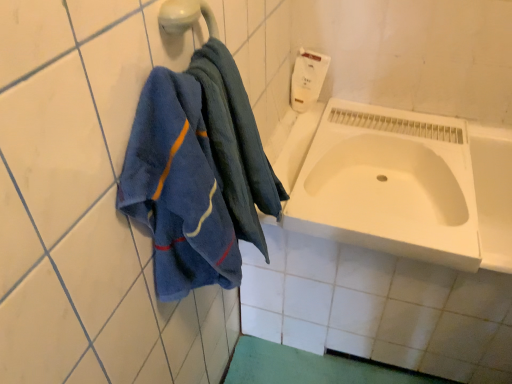
Where is `white glossy bathtub at center`? white glossy bathtub at center is located at coordinates (393, 266).

Identify the location of white matte sink at lower right. (389, 185).

What are the coordinates of `blue cotton towel at left` in the screenshot? It's located at (236, 143).

Considering the points (340, 236) and (304, 74), which point is in front, point (340, 236) or point (304, 74)?

Point (340, 236)

How distant is white matte sink at lower right from white matte soap dispenser at upper right?

The distance of white matte sink at lower right from white matte soap dispenser at upper right is 16.37 inches.

Is white matte sink at lower right not inside white matte soap dispenser at upper right?

Indeed, white matte sink at lower right is completely outside white matte soap dispenser at upper right.

Considering the sizes of objects white matte sink at lower right and white matte soap dispenser at upper right in the image provided, who is smaller, white matte sink at lower right or white matte soap dispenser at upper right?

Smaller between the two is white matte soap dispenser at upper right.

From the image's perspective, relative to blue cotton towel at left, is white glossy bathtub at center above or below?

Based on their image positions, white glossy bathtub at center is located beneath blue cotton towel at left.

Consider the image. From their relative heights in the image, would you say white glossy bathtub at center is taller or shorter than blue cotton towel at left?

Clearly, white glossy bathtub at center is taller compared to blue cotton towel at left.

Which object is positioned more to the left, white glossy bathtub at center or blue cotton towel at left?

blue cotton towel at left.

How many degrees apart are the facing directions of white glossy bathtub at center and blue cotton towel at left?

83.1 degrees separate the facing orientations of white glossy bathtub at center and blue cotton towel at left.

Is blue cotton towel at left to the right of white glossy bathtub at center from the viewer's perspective?

No.

Is blue cotton towel at left not near white glossy bathtub at center?

No, blue cotton towel at left is in close proximity to white glossy bathtub at center.

Is blue cotton towel at left positioned beyond the bounds of white glossy bathtub at center?

That's correct, blue cotton towel at left is outside of white glossy bathtub at center.

From a real-world perspective, is blue cotton towel at left on white glossy bathtub at center?

Yes, from a real-world perspective, blue cotton towel at left is above white glossy bathtub at center.

How many degrees apart are the facing directions of white matte soap dispenser at upper right and white glossy bathtub at center?

0.946 degrees separate the facing orientations of white matte soap dispenser at upper right and white glossy bathtub at center.

Which object is positioned more to the right, white matte soap dispenser at upper right or white glossy bathtub at center?

white glossy bathtub at center is more to the right.

Between point (304, 95) and point (356, 218), which one is positioned behind?

Positioned behind is point (304, 95).

Can you tell me how much white matte sink at lower right and blue cotton towel at left differ in facing direction?

white matte sink at lower right and blue cotton towel at left are facing 84.3 degrees away from each other.

From a real-world perspective, between white matte sink at lower right and blue cotton towel at left, who is vertically higher?

blue cotton towel at left, from a real-world perspective.

From the image's perspective, is white matte sink at lower right located above or below blue cotton towel at left?

From the image's perspective, white matte sink at lower right appears above blue cotton towel at left.

Considering the positions of objects white matte sink at lower right and blue cotton towel at left in the image provided, who is in front, white matte sink at lower right or blue cotton towel at left?

blue cotton towel at left is more forward.

How many degrees apart are the facing directions of blue cotton towel at left and white matte sink at lower right?

84.3 degrees separate the facing orientations of blue cotton towel at left and white matte sink at lower right.

Which is further, [226,170] or [311,177]?

The point [311,177] is farther.

Choose the correct answer: Is blue cotton towel at left inside white matte sink at lower right or outside it?

blue cotton towel at left exists outside the volume of white matte sink at lower right.

Considering the positions of objects blue cotton towel at left and white matte sink at lower right in the image provided, who is in front, blue cotton towel at left or white matte sink at lower right?

blue cotton towel at left is in front.

Based on the photo, from the image's perspective, is white glossy bathtub at center over white matte sink at lower right?

No, from the image's perspective, white glossy bathtub at center is not on top of white matte sink at lower right.

Where is `sink located behind the white glossy bathtub at center`? This screenshot has width=512, height=384. sink located behind the white glossy bathtub at center is located at coordinates (389, 185).

Looking at this image, considering the relative positions of white glossy bathtub at center and white matte sink at lower right in the image provided, is white glossy bathtub at center to the right of white matte sink at lower right from the viewer's perspective?

Yes, white glossy bathtub at center is to the right of white matte sink at lower right.

Is white glossy bathtub at center far from white matte sink at lower right?

white glossy bathtub at center is near white matte sink at lower right, not far away.

Locate an element on the screen. The image size is (512, 384). sink below the white matte soap dispenser at upper right (from a real-world perspective) is located at coordinates (389, 185).

You are a GUI agent. You are given a task and a screenshot of the screen. Output one action in this format:
    pyautogui.click(x=<x>, y=<y>)
    Task: Click on the bath below the blue cotton towel at left (from the image's perspective)
    The width and height of the screenshot is (512, 384).
    Given the screenshot: What is the action you would take?
    pyautogui.click(x=393, y=266)

From the image, which object appears to be nearer to white matte sink at lower right, white matte soap dispenser at upper right or blue cotton towel at left?

Based on the image, white matte soap dispenser at upper right appears to be nearer to white matte sink at lower right.

Which object lies nearer to the anchor point white matte soap dispenser at upper right, white glossy bathtub at center or blue cotton towel at left?

The object closer to white matte soap dispenser at upper right is white glossy bathtub at center.

Which object lies nearer to the anchor point white matte sink at lower right, white matte soap dispenser at upper right or white glossy bathtub at center?

white glossy bathtub at center is positioned closer to the anchor white matte sink at lower right.

Looking at the image, which one is located closer to blue cotton towel at left, white matte soap dispenser at upper right or white matte sink at lower right?

white matte sink at lower right is closer to blue cotton towel at left.

Looking at the image, which one is located further to blue cotton towel at left, white glossy bathtub at center or white matte sink at lower right?

white glossy bathtub at center is positioned further to the anchor blue cotton towel at left.

Estimate the real-world distances between objects in this image. Which object is closer to blue cotton towel at left, white glossy bathtub at center or white matte soap dispenser at upper right?

Based on the image, white glossy bathtub at center appears to be nearer to blue cotton towel at left.

Which object lies further to the anchor point white matte sink at lower right, blue cotton towel at left or white matte soap dispenser at upper right?

blue cotton towel at left is positioned further to the anchor white matte sink at lower right.

Looking at this image, considering their positions, is white matte sink at lower right positioned further to white glossy bathtub at center than white matte soap dispenser at upper right?

white matte soap dispenser at upper right is further to white glossy bathtub at center.

This screenshot has width=512, height=384. I want to click on bath between blue cotton towel at left and white matte soap dispenser at upper right in the front-back direction, so click(x=393, y=266).

Find the location of a particular element. The width and height of the screenshot is (512, 384). sink located between blue cotton towel at left and white matte soap dispenser at upper right in the depth direction is located at coordinates (389, 185).

The width and height of the screenshot is (512, 384). In order to click on sink between white matte soap dispenser at upper right and white glossy bathtub at center in the up-down direction in this screenshot , I will do `click(389, 185)`.

I want to click on sink located between blue cotton towel at left and white glossy bathtub at center in the left-right direction, so click(x=389, y=185).